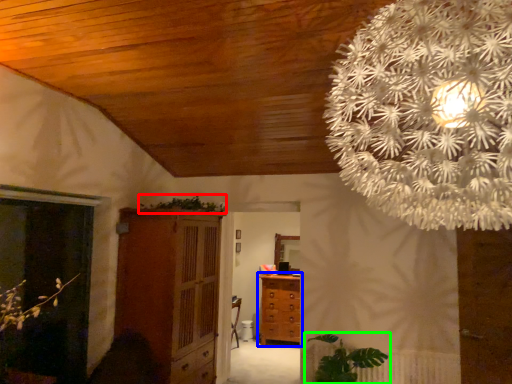
Question: Considering the real-world distances, which object is farthest from plant (highlighted by a red box)? chest of drawers (highlighted by a blue box) or houseplant (highlighted by a green box)?

Choices:
 (A) chest of drawers
 (B) houseplant

Answer: (B)